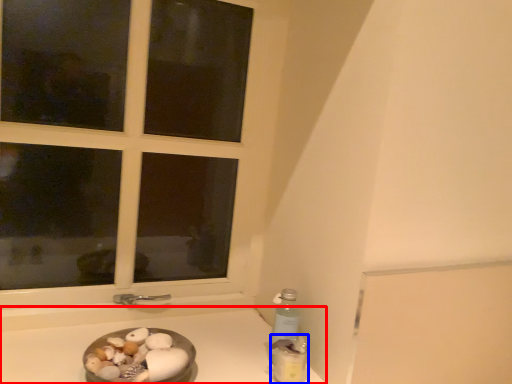
Question: Which of the following is the closest to the observer, counter top (highlighted by a red box) or bottle (highlighted by a blue box)?

Choices:
 (A) counter top
 (B) bottle

Answer: (A)